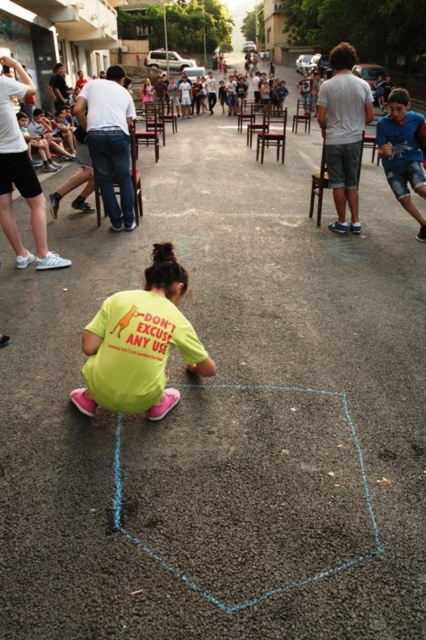
You are a photographer standing at the edge of the paved area. You want to capture a photo that includes both the yellow matte shirt at lower center and the blue denim shorts at right. Which object should you focus on first to ensure both are in the frame?

You should focus on the yellow matte shirt at lower center first because it is closer to the viewer than the blue denim shorts at right, so adjusting the frame to include the closer object first will help ensure both are visible.

You are a photographer trying to capture the scene. The yellow matte shirt at lower center and the blue denim shorts at right are both in the frame. Which object appears narrower in the photo?

The yellow matte shirt at lower center appears narrower because its width is less than the blue denim shorts at right.

You are a photographer trying to capture the scene. You want to ensure both the yellow matte shirt at lower center and the blue denim shorts at right are clearly visible in your photo. Considering their sizes, which object should you focus on to ensure both are in frame?

The yellow matte shirt at lower center occupies less space than the blue denim shorts at right. To ensure both are in frame, focus on the larger object, the blue denim shorts at right, as it will help keep the smaller yellow matte shirt at lower center within the camera view.